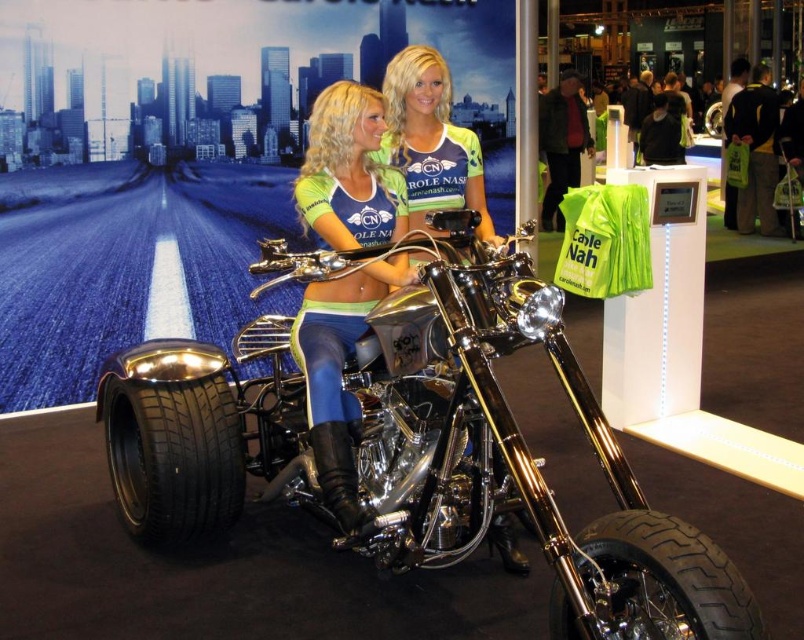
Does matte green jersey at center appear under black rubber tire at lower right?

Actually, matte green jersey at center is above black rubber tire at lower right.

This screenshot has height=640, width=804. Find the location of `matte green jersey at center`. matte green jersey at center is located at coordinates (338, 372).

Identify the location of matte green jersey at center. (338, 372).

Which is more to the left, matte green jersey at center or shiny metallic tank top at center?

matte green jersey at center

This screenshot has height=640, width=804. What do you see at coordinates (338, 372) in the screenshot? I see `matte green jersey at center` at bounding box center [338, 372].

Does point (339, 136) lie behind point (417, 163)?

No, (339, 136) is closer to viewer.

Image resolution: width=804 pixels, height=640 pixels. I want to click on matte green jersey at center, so click(338, 372).

Does black rubber tire at lower left appear over black rubber tire at lower right?

Yes.

Does black rubber tire at lower left appear under black rubber tire at lower right?

No, black rubber tire at lower left is not below black rubber tire at lower right.

The height and width of the screenshot is (640, 804). What do you see at coordinates (173, 458) in the screenshot?
I see `black rubber tire at lower left` at bounding box center [173, 458].

At what (x,y) coordinates should I click in order to perform the action: click on black rubber tire at lower left. Please return your answer as a coordinate pair (x, y). The image size is (804, 640). Looking at the image, I should click on (173, 458).